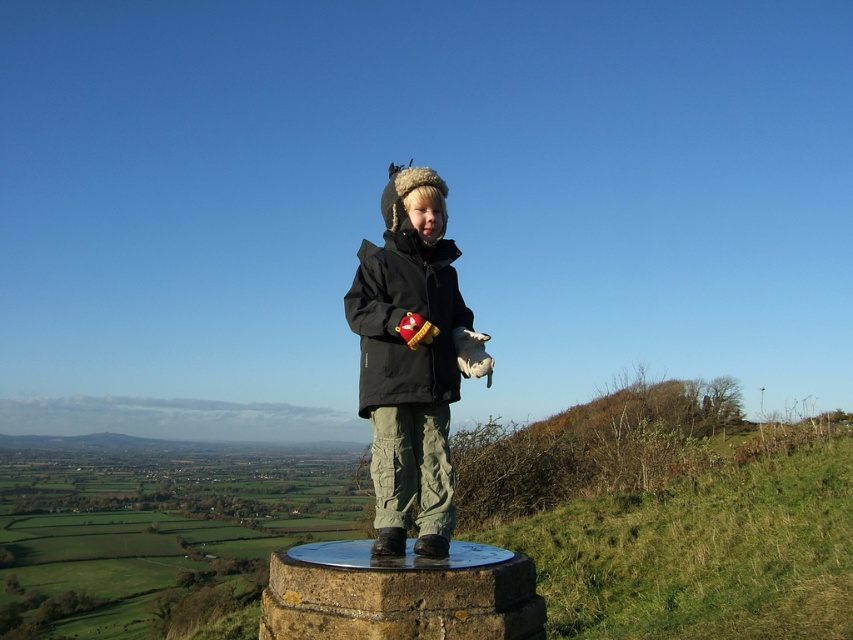
You are a drone operator trying to capture a photo of the child on the stone pedestal. The camera is currently positioned at point A, which is at coordinates [399,595]. To avoid blocking the view, you need to move the camera to a position where it can see the child clearly. Based on the scene description, is the current position at point A obstructed by the stone pedestal?

The point at coordinates [399,595] marks the stone at center, so the camera positioned there would be directly on the stone pedestal. This means the camera is obstructed by the stone pedestal and cannot see the child clearly. Move the camera to a different position away from the stone to get an unobstructed view.

You are a photographer planning to take a photo of the child standing on the pedestal. You need to ensure that both the stone at center and the black synthetic jacket at center are clearly visible in the frame. Based on their positions, which object will appear closer to the camera?

The black synthetic jacket at center appears closer to the camera because it is positioned above the stone at center, which is beneath it.

You are a photographer trying to capture the child in the scene. Since the stone at center and the black synthetic jacket at center are both at the center, which one is more to the right?

The stone at center is positioned on the right side of black synthetic jacket at center, so the stone at center is more to the right.